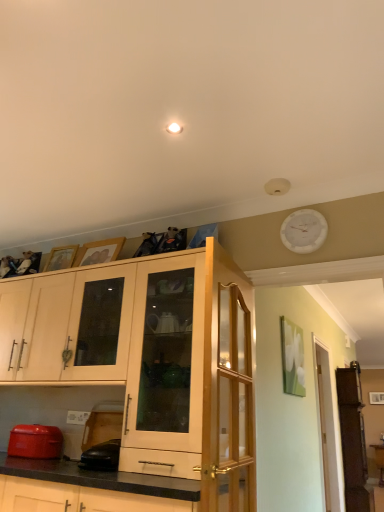
Question: In which direction should I rotate to look at clear wood glass door at upper center, the first glass door when ordered from front to back?

Choices:
 (A) left
 (B) right

Answer: (B)

Question: Considering the relative sizes of black rubber mouse at lower left, which ranks as the 2th appliance in left-to-right order, and clear glass door at right, which is the 2th glass door in left-to-right order, in the image provided, is black rubber mouse at lower left, which ranks as the 2th appliance in left-to-right order, wider than clear glass door at right, which is the 2th glass door in left-to-right order,?

Choices:
 (A) no
 (B) yes

Answer: (A)

Question: Could you tell me if black rubber mouse at lower left, which ranks as the 2th appliance in left-to-right order, is turned towards clear glass door at right, positioned as the second glass door in front-to-back order?

Choices:
 (A) yes
 (B) no

Answer: (B)

Question: Can you confirm if black rubber mouse at lower left, which ranks as the 2th appliance in left-to-right order, is shorter than clear glass door at right, which ranks as the first glass door in back-to-front order?

Choices:
 (A) no
 (B) yes

Answer: (B)

Question: Is black rubber mouse at lower left, the 1th appliance positioned from the right, facing away from clear glass door at right, which is the 2th glass door in left-to-right order?

Choices:
 (A) yes
 (B) no

Answer: (A)

Question: Can you confirm if black rubber mouse at lower left, the 1th appliance positioned from the right, is positioned to the left of clear glass door at right, which is the 2th glass door in left-to-right order?

Choices:
 (A) yes
 (B) no

Answer: (A)

Question: From the image's perspective, is black rubber mouse at lower left, which ranks as the 2th appliance in left-to-right order, on top of clear glass door at right, positioned as the second glass door in front-to-back order?

Choices:
 (A) yes
 (B) no

Answer: (A)

Question: From a real-world perspective, is matte red toaster at lower left, which is the second appliance from right to left, over matte wood cabinet at center, the 2th cabinetry positioned from the left?

Choices:
 (A) no
 (B) yes

Answer: (A)

Question: Is matte red toaster at lower left, which is the second appliance from right to left, not close to matte wood cabinet at center, acting as the 1th cabinetry starting from the right?

Choices:
 (A) no
 (B) yes

Answer: (A)

Question: Does matte red toaster at lower left, which is the second appliance from right to left, have a larger size compared to matte wood cabinet at center, the 2th cabinetry positioned from the left?

Choices:
 (A) yes
 (B) no

Answer: (B)

Question: Considering the relative sizes of matte red toaster at lower left, marked as the first appliance in a left-to-right arrangement, and matte wood cabinet at center, acting as the 1th cabinetry starting from the right, in the image provided, is matte red toaster at lower left, marked as the first appliance in a left-to-right arrangement, taller than matte wood cabinet at center, acting as the 1th cabinetry starting from the right,?

Choices:
 (A) no
 (B) yes

Answer: (A)

Question: From the image's perspective, does matte red toaster at lower left, marked as the first appliance in a left-to-right arrangement, appear lower than matte wood cabinet at center, acting as the 1th cabinetry starting from the right?

Choices:
 (A) no
 (B) yes

Answer: (B)

Question: Would you say matte red toaster at lower left, marked as the first appliance in a left-to-right arrangement, contains matte wood cabinet at center, acting as the 1th cabinetry starting from the right?

Choices:
 (A) no
 (B) yes

Answer: (A)

Question: Is matte wood cabinet at center, the 2th cabinetry positioned from the left, thinner than white plastic clock at upper right?

Choices:
 (A) yes
 (B) no

Answer: (B)